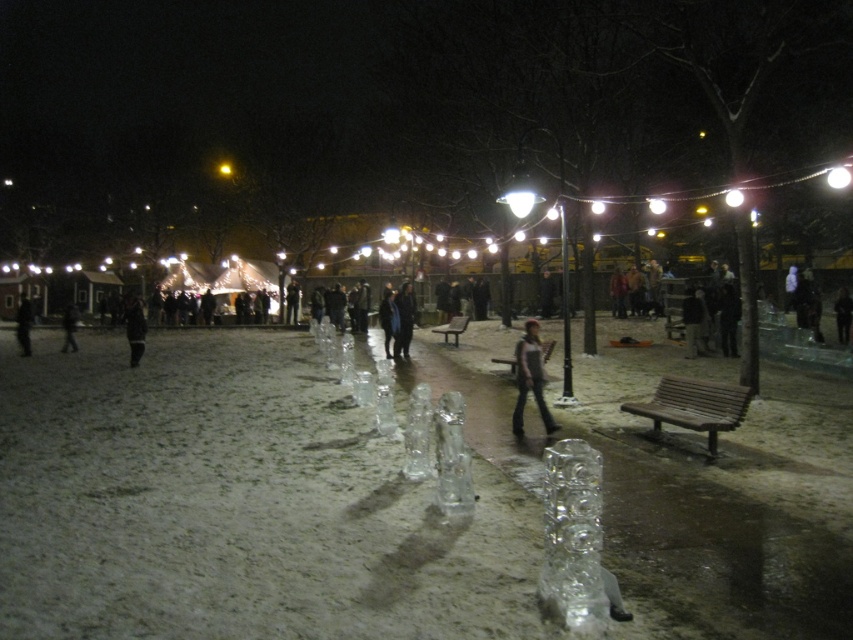
What are the coordinates of `dark gray jeans at center` in the screenshot? It's located at (531, 378).

Based on the photo, is dark gray jeans at center to the left of black matte jacket at center from the viewer's perspective?

Incorrect, dark gray jeans at center is not on the left side of black matte jacket at center.

Describe the element at coordinates (531, 378) in the screenshot. I see `dark gray jeans at center` at that location.

The height and width of the screenshot is (640, 853). I want to click on dark gray jeans at center, so click(x=531, y=378).